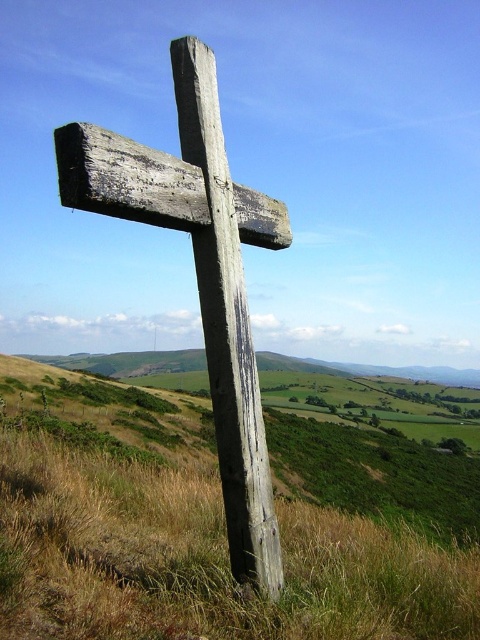
From the picture: You are a photographer trying to capture the weathered wood cross at center from a low angle. Considering the dry grass at center, will the grass obscure the base of the cross in your photo?

The dry grass at center has a lesser height compared to the weathered wood cross at center, so the grass will not obscure the base of the cross in your photo.

You are a photographer trying to capture the weathered wood cross at center and the dry grass at center in your shot. Which object is located to the right of the other?

The dry grass at center is positioned on the left side of weathered wood cross at center, so the weathered wood cross at center is to the right of the dry grass at center.